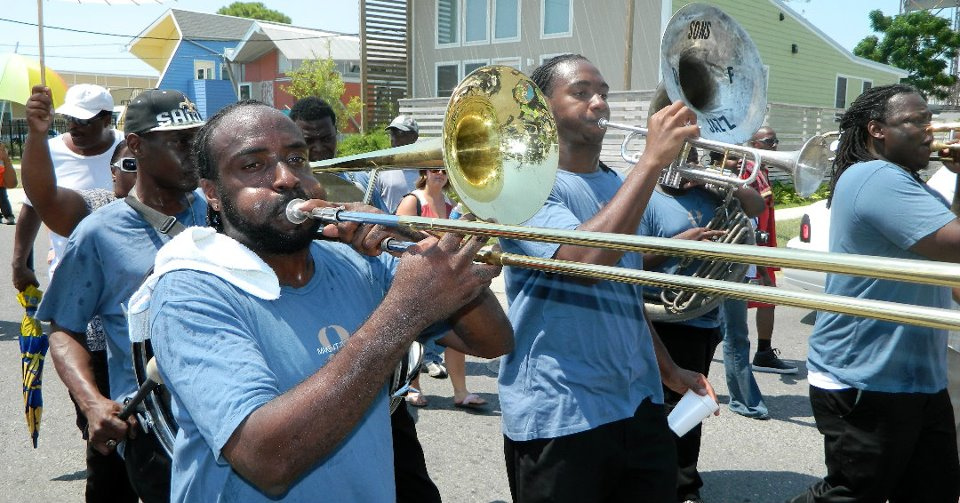
This screenshot has width=960, height=503. What are the coordinates of `white rag` in the screenshot? It's located at (241, 267).